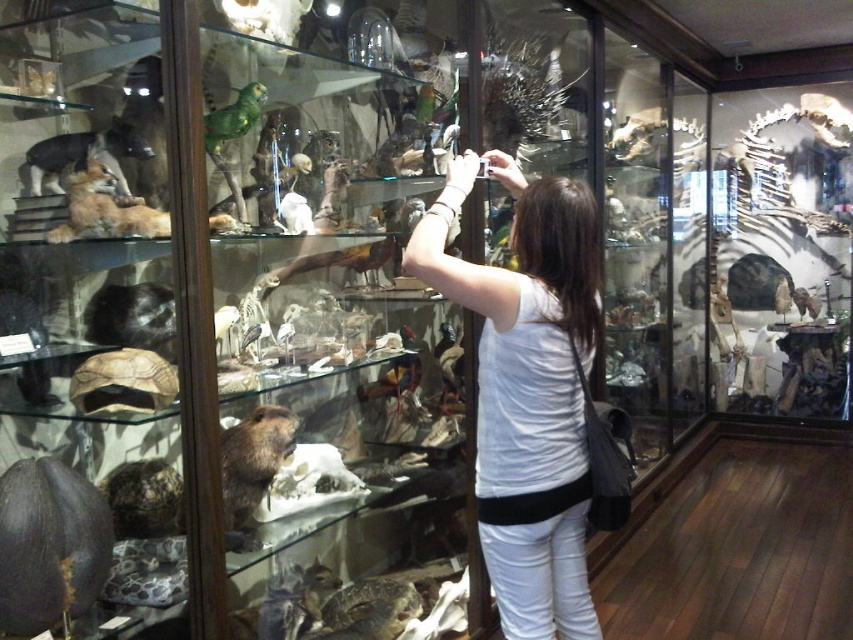
Does brown furry beaver at lower left come behind brown textured tortoise at lower left?

That is True.

Who is shorter, brown furry beaver at lower left or brown textured tortoise at lower left?

brown textured tortoise at lower left is shorter.

Locate an element on the screen. This screenshot has width=853, height=640. brown furry beaver at lower left is located at coordinates (253, 460).

I want to click on brown furry beaver at lower left, so click(253, 460).

Is point (163, 404) closer to camera compared to point (120, 145)?

Yes, it is in front of point (120, 145).

Which is more to the left, brown textured tortoise at lower left or brown fur dog at left?

Positioned to the left is brown fur dog at left.

Does point (90, 396) lie in front of point (117, 122)?

Yes, it is in front of point (117, 122).

Identify the location of brown textured tortoise at lower left. (123, 381).

Between white cotton shirt at center and brown fur dog at left, which one is positioned higher?

brown fur dog at left is above.

Between white cotton shirt at center and brown fur dog at left, which one is positioned lower?

white cotton shirt at center is below.

This screenshot has height=640, width=853. I want to click on white cotton shirt at center, so click(527, 388).